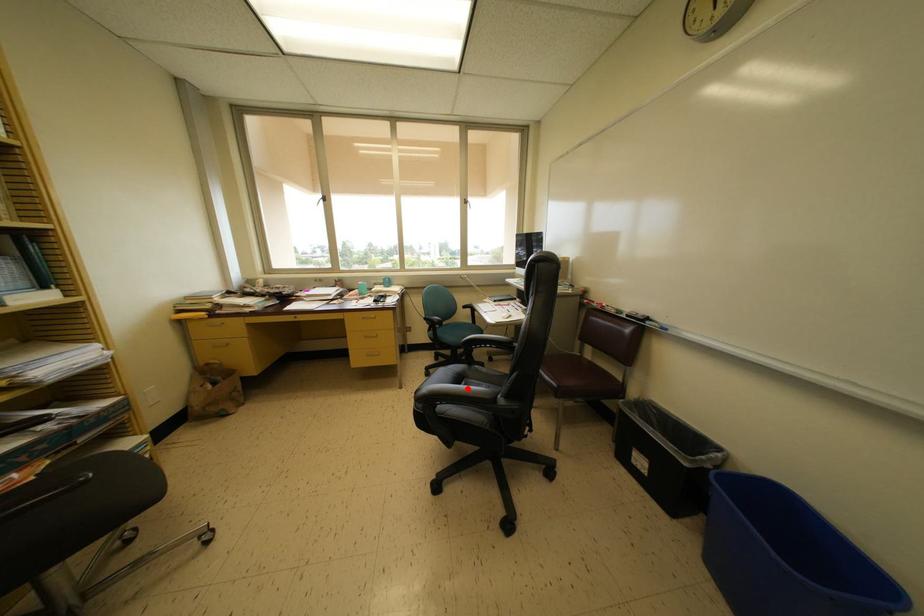
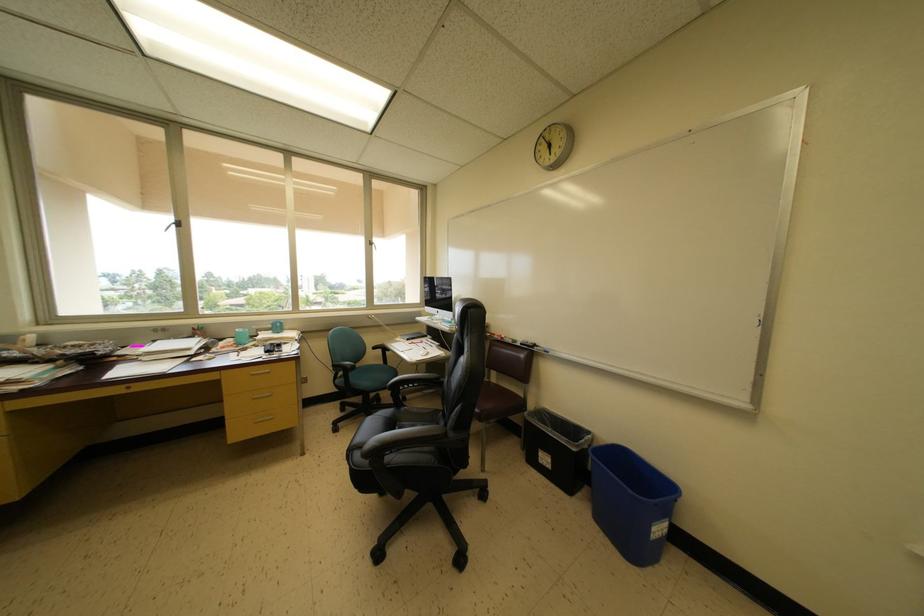
The point at the highlighted location is marked in the first image. Where is the corresponding point in the second image?

(400, 432)